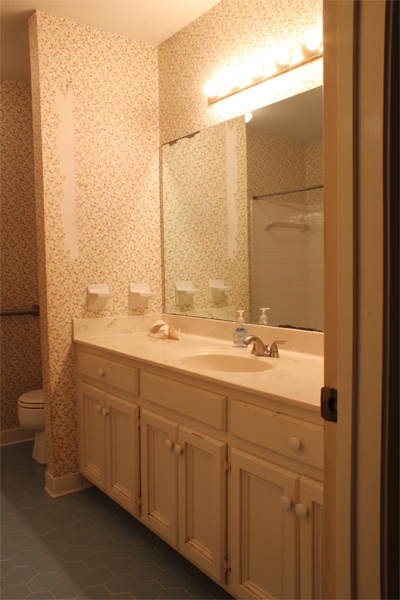
At what (x,y) coordinates should I click in order to perform the action: click on ceiling. Please return your answer as a coordinate pair (x, y). Looking at the image, I should click on (113, 10), (11, 34), (292, 118).